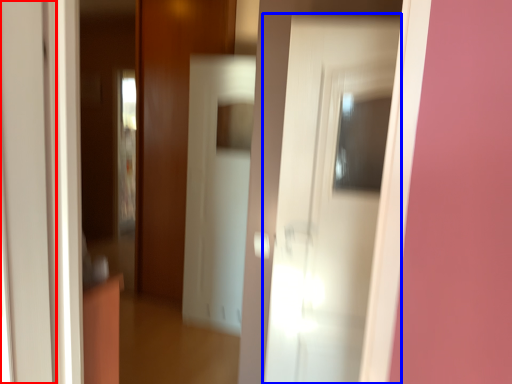
Question: Which object appears closest to the camera in this image, door (highlighted by a red box) or door (highlighted by a blue box)?

Choices:
 (A) door
 (B) door

Answer: (A)